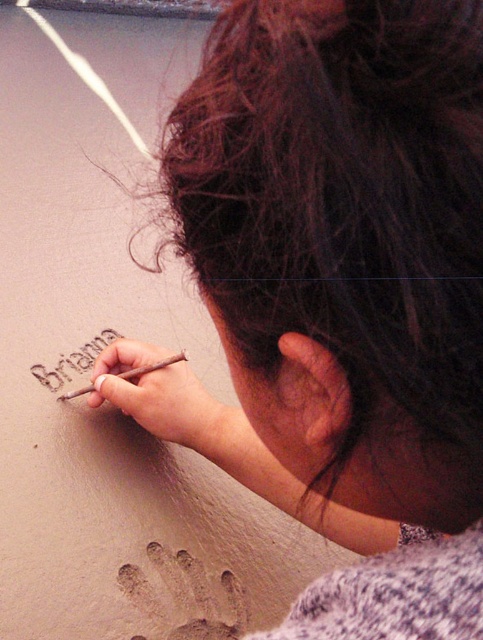
Who is positioned more to the right, smooth wooden pencil at center or brown wooden pencil at lower left?

Positioned to the right is smooth wooden pencil at center.

Does smooth wooden pencil at center appear on the left side of brown wooden pencil at lower left?

Incorrect, smooth wooden pencil at center is not on the left side of brown wooden pencil at lower left.

Which is behind, point (128, 349) or point (80, 394)?

Positioned behind is point (80, 394).

Where is `smooth wooden pencil at center`? This screenshot has height=640, width=483. smooth wooden pencil at center is located at coordinates (156, 394).

Measure the distance between smooth wooden pencil at center and camera.

smooth wooden pencil at center is 27.18 inches away from camera.

Between smooth wooden pencil at center and brown clay name at center, which one has less height?

brown clay name at center is shorter.

Is point (182, 404) positioned behind point (95, 337)?

No, (182, 404) is in front of (95, 337).

Find the location of a particular element. The height and width of the screenshot is (640, 483). smooth wooden pencil at center is located at coordinates (156, 394).

Which is below, brown clay name at center or brown wooden pencil at lower left?

brown wooden pencil at lower left

Is brown clay name at center positioned before brown wooden pencil at lower left?

No.

Image resolution: width=483 pixels, height=640 pixels. In order to click on brown clay name at center in this screenshot , I will do `click(72, 362)`.